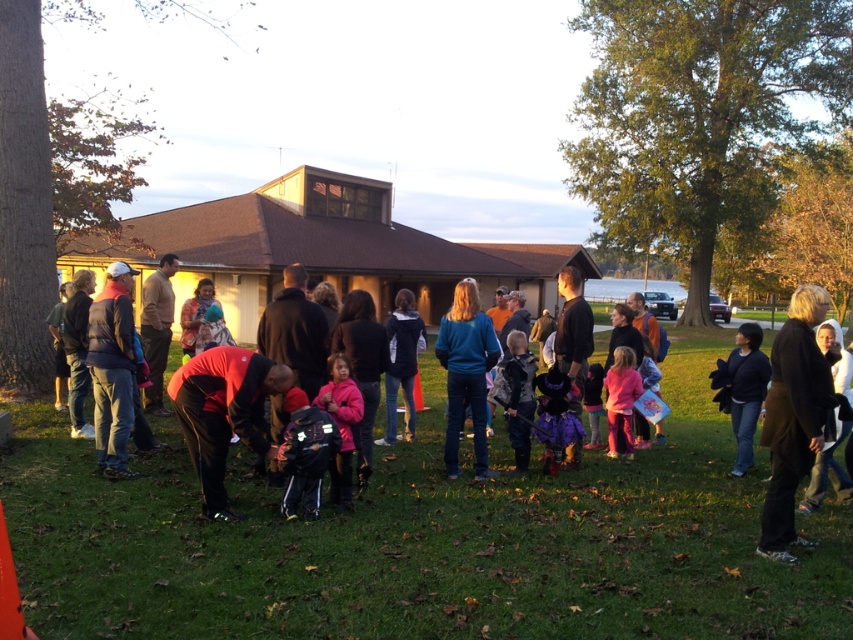
You are a hiker who just arrived at the park and wants to place your backpack next to your dress. Based on the scene, will the matte black backpack at center fit next to the pink matte dress at lower right without overlapping?

The matte black backpack at center might be wider than pink matte dress at lower right, so there might not be enough space to place them side by side without overlapping.

You are attending an outdoor autumn event and need to decide which dress to take home. You see the purple satin dress at center and the pink matte dress at lower right. Which dress is physically nearer to you?

The purple satin dress at center is closer to the viewer than the pink matte dress at lower right.